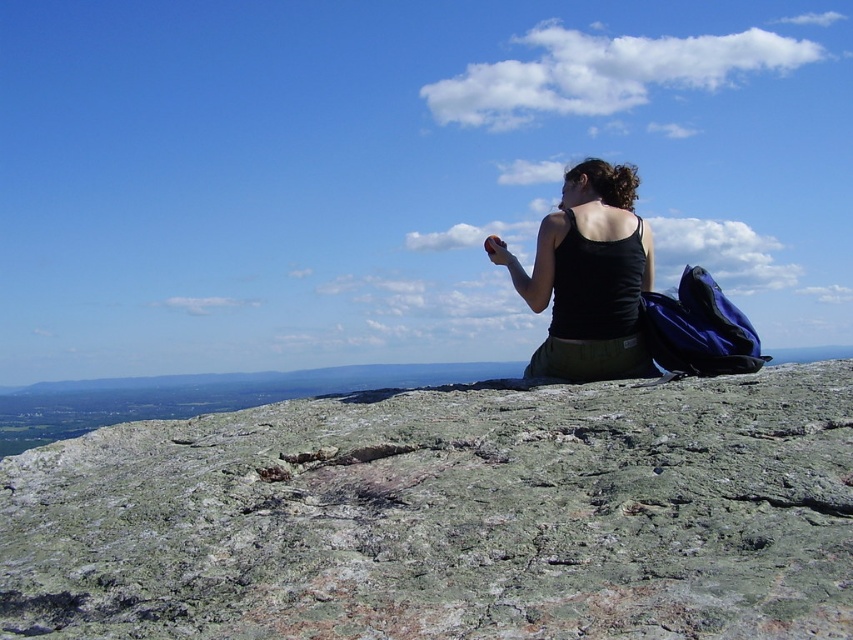
You are a hiker who wants to place your backpack on the green rough rock at center. Considering the height of the rock and the black tank top at center, will the backpack fit comfortably on the rock without falling over?

The green rough rock at center has a lesser height compared to the black tank top at center. Since the rock is shorter than the tank top, the backpack might not have enough stability and could tip over if placed there.

You are standing at the camera position and see two points in the scene. Which point, point (759, 520) or point (607, 259), is closer to you?

Point (759, 520) is closer to you than point (607, 259).